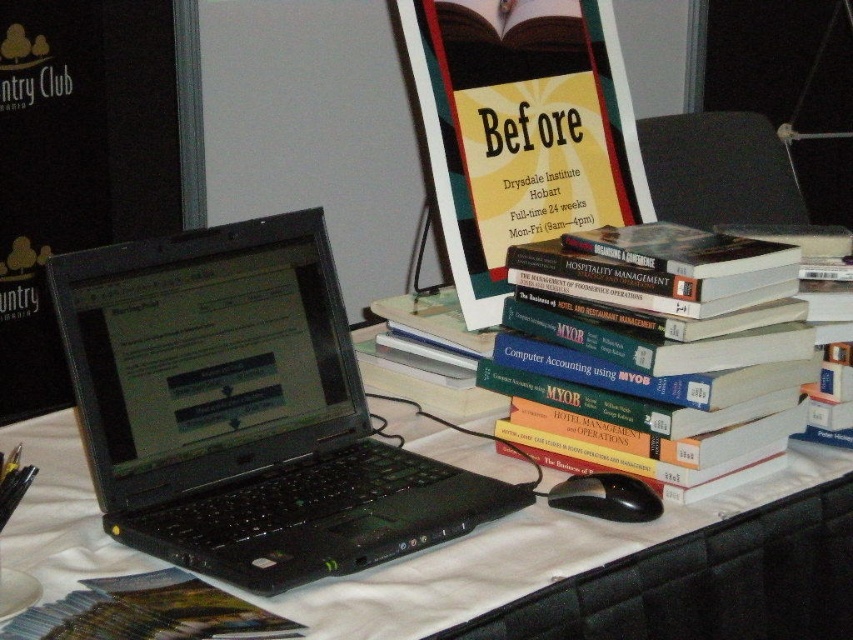
Question: Observing the image, what is the correct spatial positioning of black plastic table at center in reference to green matte book at lower left?

Choices:
 (A) below
 (B) above

Answer: (B)

Question: Does black plastic table at center appear on the right side of black plastic mouse at lower center?

Choices:
 (A) no
 (B) yes

Answer: (A)

Question: Which point is farther to the camera?

Choices:
 (A) (122, 268)
 (B) (515, 396)

Answer: (B)

Question: Which point is farther to the camera?

Choices:
 (A) (117, 609)
 (B) (546, 387)
 (C) (13, 438)
 (D) (567, 502)

Answer: (C)

Question: Among these points, which one is farthest from the camera?

Choices:
 (A) (287, 433)
 (B) (175, 612)
 (C) (595, 484)
 (D) (689, 339)

Answer: (A)

Question: Considering the relative positions of black plastic table at center and black plastic mouse at lower center in the image provided, where is black plastic table at center located with respect to black plastic mouse at lower center?

Choices:
 (A) above
 (B) below

Answer: (B)